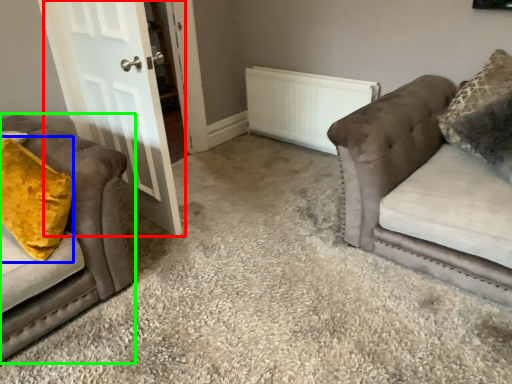
Question: Based on their relative distances, which object is farther from door (highlighted by a red box)? Choose from throw pillow (highlighted by a blue box) and studio couch (highlighted by a green box).

Choices:
 (A) throw pillow
 (B) studio couch

Answer: (A)